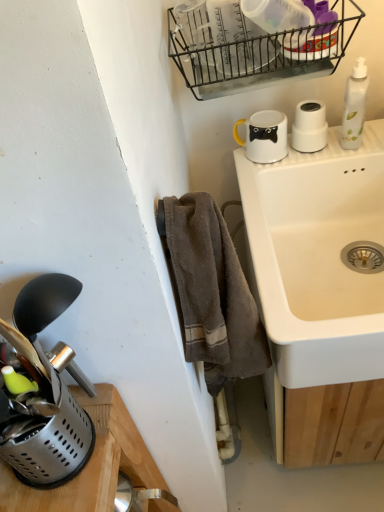
Measure the distance between white ceramic sink at upper right and camera.

A distance of 26.80 inches exists between white ceramic sink at upper right and camera.

Identify the location of white translucent bottle at upper right. (354, 106).

Between white glossy mug at upper center, the second appliance from the right, and brown cotton towel at lower center, which one has larger size?

Bigger between the two is brown cotton towel at lower center.

At what (x,y) coordinates should I click in order to perform the action: click on bath towel below the white glossy mug at upper center, the second appliance from the right (from the image's perspective). Please return your answer as a coordinate pair (x, y). The width and height of the screenshot is (384, 512). Looking at the image, I should click on (211, 291).

Is point (255, 160) closer or farther from the camera than point (239, 305)?

Point (255, 160).

How distant is white glossy mug at upper center, the second appliance positioned from the top, from black wire basket at upper center?

7.08 inches.

Can you confirm if white glossy mug at upper center, the second appliance from the right, is wider than black wire basket at upper center?

Incorrect, the width of white glossy mug at upper center, the second appliance from the right, does not surpass that of black wire basket at upper center.

From the image's perspective, is white glossy mug at upper center, which appears as the 2th appliance when viewed from the front, located above black wire basket at upper center?

Actually, white glossy mug at upper center, which appears as the 2th appliance when viewed from the front, appears below black wire basket at upper center in the image.

Is white glossy mug at upper center, the second appliance positioned from the top, positioned far away from black wire basket at upper center?

white glossy mug at upper center, the second appliance positioned from the top, is near black wire basket at upper center, not far away.

Based on the photo, between white translucent bottle at upper right and black wire basket at upper center, which one has smaller width?

white translucent bottle at upper right is thinner.

Which is more to the right, white translucent bottle at upper right or black wire basket at upper center?

Positioned to the right is white translucent bottle at upper right.

Which object is more forward, white translucent bottle at upper right or black wire basket at upper center?

black wire basket at upper center is closer to the camera.

Is white translucent bottle at upper right not near black wire basket at upper center?

No, there isn't a large distance between white translucent bottle at upper right and black wire basket at upper center.

Is white translucent bottle at upper right to the right of white ceramic sink at upper right from the viewer's perspective?

Yes.

From the image's perspective, would you say white translucent bottle at upper right is positioned over white ceramic sink at upper right?

Yes, from the image's perspective, white translucent bottle at upper right is over white ceramic sink at upper right.

Considering the sizes of objects white translucent bottle at upper right and white ceramic sink at upper right in the image provided, who is wider, white translucent bottle at upper right or white ceramic sink at upper right?

white ceramic sink at upper right is wider.

Is brown cotton towel at lower center not close to black wire basket at upper center?

No, there isn't a large distance between brown cotton towel at lower center and black wire basket at upper center.

Between brown cotton towel at lower center and black wire basket at upper center, which one has less height?

Standing shorter between the two is black wire basket at upper center.

Considering the sizes of brown cotton towel at lower center and black wire basket at upper center in the image, is brown cotton towel at lower center wider or thinner than black wire basket at upper center?

brown cotton towel at lower center is thinner than black wire basket at upper center.

Considering the relative positions of brown cotton towel at lower center and black wire basket at upper center in the image provided, is brown cotton towel at lower center to the left of black wire basket at upper center from the viewer's perspective?

Indeed, brown cotton towel at lower center is positioned on the left side of black wire basket at upper center.

Is white glossy mug at upper center, which appears as the 2th appliance when viewed from the front, wider or thinner than metallic silver utensil holder at lower left, positioned as the 1th appliance in left-to-right order?

Considering their sizes, white glossy mug at upper center, which appears as the 2th appliance when viewed from the front, looks slimmer than metallic silver utensil holder at lower left, positioned as the 1th appliance in left-to-right order.

I want to click on appliance on the left of white glossy mug at upper center, the second appliance positioned from the top, so click(42, 390).

Looking at this image, are white glossy mug at upper center, the second appliance when ordered from back to front, and metallic silver utensil holder at lower left, the 3th appliance from the top, located far from each other?

white glossy mug at upper center, the second appliance when ordered from back to front, is actually quite close to metallic silver utensil holder at lower left, the 3th appliance from the top.

From the image's perspective, which object appears higher, white glossy mug at upper center, arranged as the 2th appliance when ordered from the bottom, or metallic silver utensil holder at lower left, the 3th appliance from the top?

white glossy mug at upper center, arranged as the 2th appliance when ordered from the bottom, appears higher in the image.

Is white glossy mug at upper center, which ranks as the second appliance in left-to-right order, completely or partially inside metallic silver utensil holder at lower left, the 3th appliance from the top?

Definitely not — white glossy mug at upper center, which ranks as the second appliance in left-to-right order, is not inside metallic silver utensil holder at lower left, the 3th appliance from the top.

Can you confirm if metallic silver utensil holder at lower left, positioned as the 1th appliance in left-to-right order, is wider than white glossy mug at upper center, the second appliance when ordered from back to front?

Correct, the width of metallic silver utensil holder at lower left, positioned as the 1th appliance in left-to-right order, exceeds that of white glossy mug at upper center, the second appliance when ordered from back to front.

How many degrees apart are the facing directions of metallic silver utensil holder at lower left, positioned as the 1th appliance in left-to-right order, and white glossy mug at upper center, which appears as the 2th appliance when viewed from the front?

91.3 degrees.

Measure the distance between metallic silver utensil holder at lower left, positioned as the 1th appliance in left-to-right order, and white glossy mug at upper center, the second appliance from the right.

A distance of 27.96 inches exists between metallic silver utensil holder at lower left, positioned as the 1th appliance in left-to-right order, and white glossy mug at upper center, the second appliance from the right.

Find the location of a particular element. The height and width of the screenshot is (512, 384). appliance that is the 1st object to the right of the brown cotton towel at lower center, starting at the anchor is located at coordinates (264, 136).

Image resolution: width=384 pixels, height=512 pixels. Find the location of `the 2nd appliance below the black wire basket at upper center (from the image's perspective)`. the 2nd appliance below the black wire basket at upper center (from the image's perspective) is located at coordinates (x=264, y=136).

Estimate the real-world distances between objects in this image. Which object is closer to white glossy mug at upper center, arranged as the 2th appliance when ordered from the bottom, white ceramic sink at upper right or black wire basket at upper center?

black wire basket at upper center is closer to white glossy mug at upper center, arranged as the 2th appliance when ordered from the bottom.

Based on their spatial positions, is black wire basket at upper center or white ceramic sink at upper right closer to white matte cup at upper right, which is the 3th appliance in left-to-right order?

black wire basket at upper center is closer to white matte cup at upper right, which is the 3th appliance in left-to-right order.

Based on their spatial positions, is metallic silver utensil holder at lower left, the 3th appliance from the top, or white matte cup at upper right, which is the 3th appliance in left-to-right order, closer to white ceramic sink at upper right?

white matte cup at upper right, which is the 3th appliance in left-to-right order.

Estimate the real-world distances between objects in this image. Which object is further from white glossy mug at upper center, which appears as the 2th appliance when viewed from the front, brown cotton towel at lower center or black wire basket at upper center?

Among the two, brown cotton towel at lower center is located further to white glossy mug at upper center, which appears as the 2th appliance when viewed from the front.

Which object lies further to the anchor point brown cotton towel at lower center, white glossy mug at upper center, the second appliance when ordered from back to front, or metallic silver utensil holder at lower left, which is counted as the third appliance, starting from the back?

white glossy mug at upper center, the second appliance when ordered from back to front, is positioned further to the anchor brown cotton towel at lower center.

When comparing their distances from brown cotton towel at lower center, does black wire basket at upper center or white translucent bottle at upper right seem closer?

black wire basket at upper center lies closer to brown cotton towel at lower center than the other object.

Consider the image. From the image, which object appears to be farther from white translucent bottle at upper right, brown cotton towel at lower center or white glossy mug at upper center, the second appliance when ordered from back to front?

brown cotton towel at lower center is positioned further to the anchor white translucent bottle at upper right.

Which object lies nearer to the anchor point metallic silver utensil holder at lower left, positioned as the 1th appliance in left-to-right order, white matte cup at upper right, the third appliance ordered from the bottom, or white ceramic sink at upper right?

white ceramic sink at upper right.

You are a GUI agent. You are given a task and a screenshot of the screen. Output one action in this format:
    pyautogui.click(x=<x>, y=<y>)
    Task: Click on the sink between brown cotton towel at lower center and white matte cup at upper right, which is the 3th appliance in left-to-right order, from front to back
    
    Given the screenshot: What is the action you would take?
    pyautogui.click(x=317, y=258)

The height and width of the screenshot is (512, 384). I want to click on appliance between black wire basket at upper center and white matte cup at upper right, the third appliance ordered from the bottom, in the front-back direction, so click(x=264, y=136).

Locate an element on the screen. This screenshot has width=384, height=512. bottle located between brown cotton towel at lower center and white glossy mug at upper center, which appears as the 2th appliance when viewed from the front, in the depth direction is located at coordinates (354, 106).

Find the location of a particular element. This screenshot has width=384, height=512. appliance located between white glossy mug at upper center, arranged as the 2th appliance when ordered from the bottom, and white translucent bottle at upper right in the left-right direction is located at coordinates (309, 126).